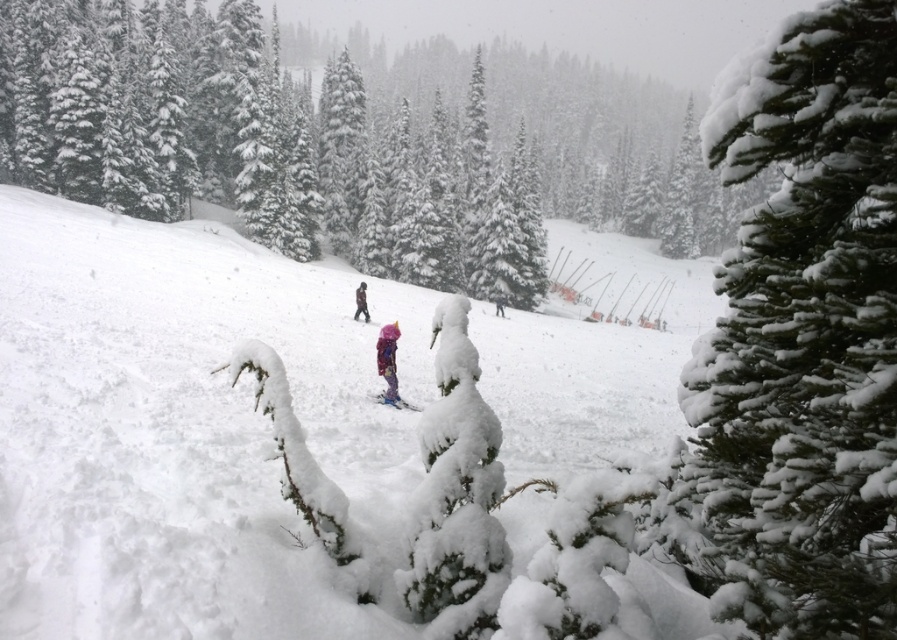
Question: Does dark brown snowsuit at center have a larger size compared to matte blue ski at center?

Choices:
 (A) yes
 (B) no

Answer: (A)

Question: Can you confirm if white fluffy snow at center is smaller than dark brown snowsuit at center?

Choices:
 (A) yes
 (B) no

Answer: (B)

Question: Can you confirm if snow-covered evergreen at center-right is positioned below matte blue ski at center?

Choices:
 (A) no
 (B) yes

Answer: (A)

Question: Which point appears closest to the camera in this image?

Choices:
 (A) (392, 326)
 (B) (86, 380)
 (C) (367, 316)
 (D) (367, 321)

Answer: (B)

Question: Which point is closer to the camera?

Choices:
 (A) matte blue ski at center
 (B) dark brown snowsuit at center
 (C) matte pink ski at center
 (D) snow-covered evergreen at center-right

Answer: (D)

Question: Which of the following is the farthest from the observer?

Choices:
 (A) snow-covered evergreen at center-right
 (B) matte blue ski at center
 (C) matte pink ski at center
 (D) dark brown snowsuit at center

Answer: (C)